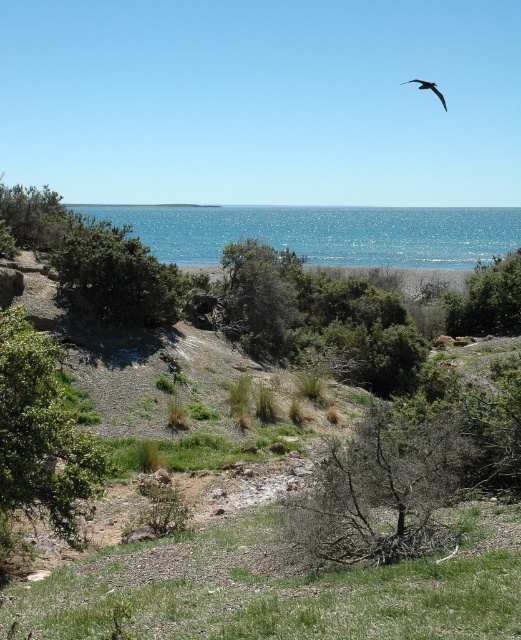
Is green leafy tree at lower left smaller than green leafy tree at center?

Yes, green leafy tree at lower left is smaller than green leafy tree at center.

Does green leafy tree at lower left have a lesser width compared to green leafy tree at center?

Indeed, green leafy tree at lower left has a lesser width compared to green leafy tree at center.

Is point (31, 410) more distant than point (271, 353)?

No, it is in front of (271, 353).

Locate an element on the screen. green leafy tree at lower left is located at coordinates (40, 436).

Can you confirm if green leafy tree at lower left is positioned to the left of dark gray feathered bird at upper right?

Correct, you'll find green leafy tree at lower left to the left of dark gray feathered bird at upper right.

Where is `green leafy tree at lower left`? Image resolution: width=521 pixels, height=640 pixels. green leafy tree at lower left is located at coordinates (40, 436).

You are a GUI agent. You are given a task and a screenshot of the screen. Output one action in this format:
    pyautogui.click(x=<x>, y=<y>)
    Task: Click on the green leafy tree at lower left
    Image resolution: width=521 pixels, height=640 pixels.
    Given the screenshot: What is the action you would take?
    pyautogui.click(x=40, y=436)

Who is taller, bare branches at center or green leafy tree at lower left?

green leafy tree at lower left

Which is behind, point (389, 474) or point (33, 454)?

The point (33, 454) is more distant.

Who is more distant from viewer, (320, 465) or (4, 486)?

Positioned behind is point (320, 465).

You are a GUI agent. You are given a task and a screenshot of the screen. Output one action in this format:
    pyautogui.click(x=<x>, y=<y>)
    Task: Click on the bare branches at center
    The height and width of the screenshot is (640, 521).
    Given the screenshot: What is the action you would take?
    pyautogui.click(x=381, y=486)